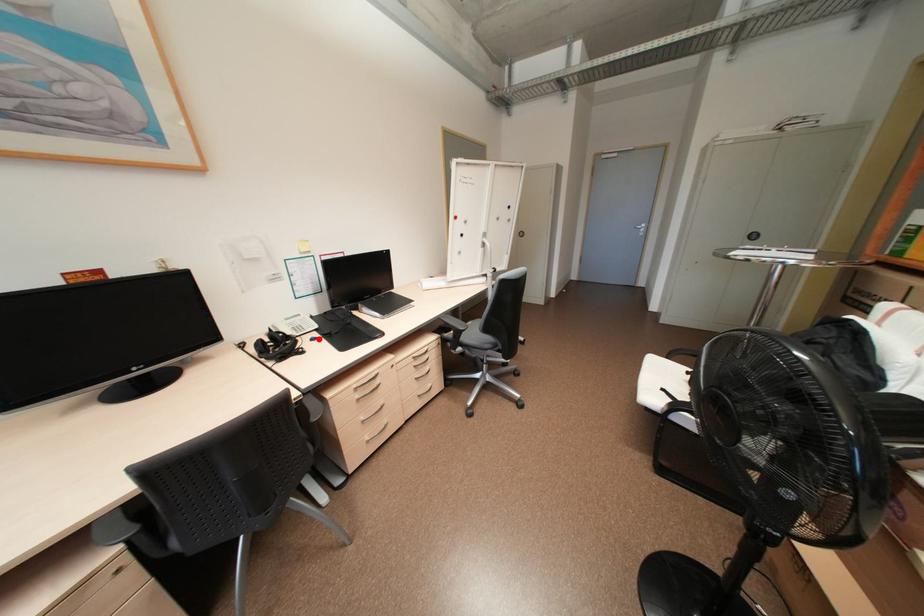
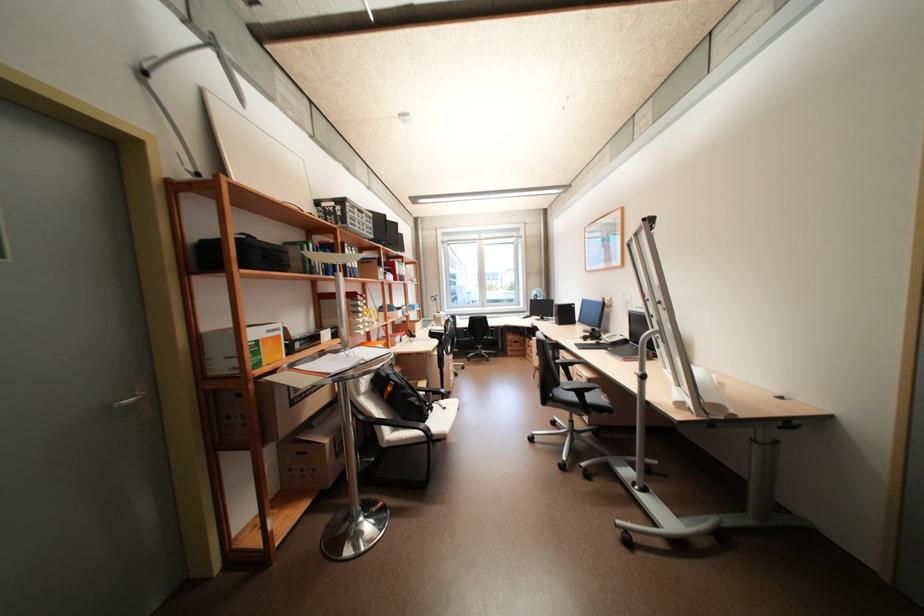
Where in the second image is the point corresponding to the highlighted location from the first image?

(603, 342)